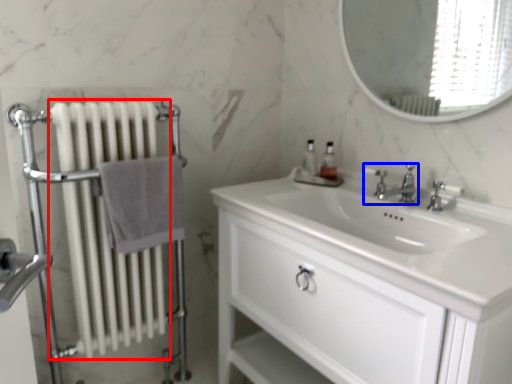
Question: Which object is closer to the camera taking this photo, radiator (highlighted by a red box) or tap (highlighted by a blue box)?

Choices:
 (A) radiator
 (B) tap

Answer: (A)